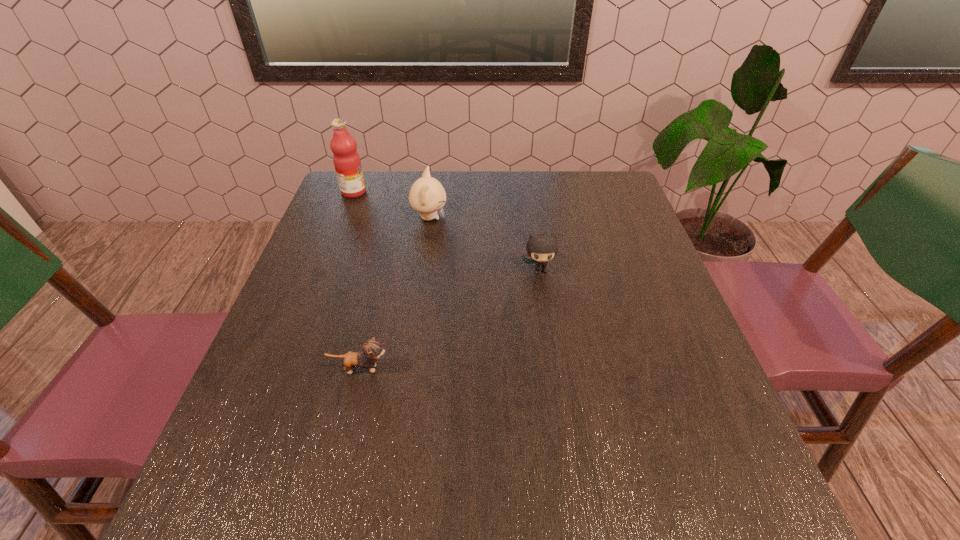
Where is `fruit juice`? The width and height of the screenshot is (960, 540). fruit juice is located at coordinates (346, 159).

Locate an element on the screen. The height and width of the screenshot is (540, 960). the tallest object is located at coordinates (346, 159).

Where is `the farthest kitten`? The height and width of the screenshot is (540, 960). the farthest kitten is located at coordinates (427, 195).

Where is `the third nearest object`? the third nearest object is located at coordinates (427, 195).

Identify the location of the third tallest object. (541, 248).

Identify the location of the rightmost kitten. (541, 248).

This screenshot has height=540, width=960. Identify the location of the shortest kitten. (372, 349).

The width and height of the screenshot is (960, 540). I want to click on the shortest object, so click(x=372, y=349).

You are a GUI agent. You are given a task and a screenshot of the screen. Output one action in this format:
    pyautogui.click(x=<x>, y=<y>)
    Task: Click on the blank space located 0.130m on the label of the tallest object
    The width and height of the screenshot is (960, 540).
    Given the screenshot: What is the action you would take?
    pyautogui.click(x=410, y=192)

Locate an element on the screen. The width and height of the screenshot is (960, 540). blank area located on the face of the third shortest object is located at coordinates (581, 218).